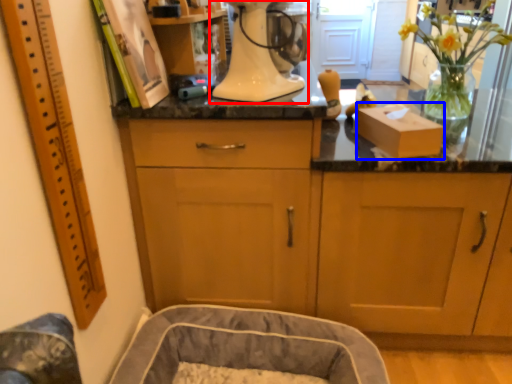
Question: Which object is further to the camera taking this photo, home appliance (highlighted by a red box) or cardboard box (highlighted by a blue box)?

Choices:
 (A) home appliance
 (B) cardboard box

Answer: (B)